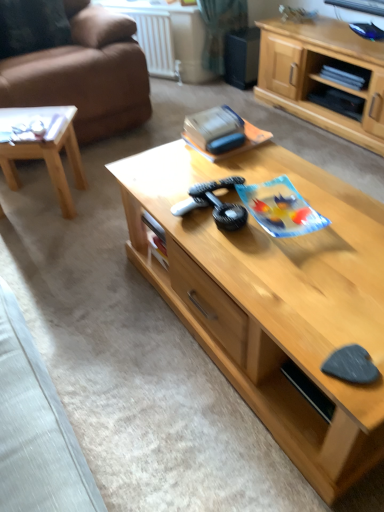
Question: Do you think brown leather couch at left is within light brown wood coffee table at left, marked as the 2th coffee table in a right-to-left arrangement, or outside of it?

Choices:
 (A) inside
 (B) outside

Answer: (B)

Question: Considering the positions of brown leather couch at left and light brown wood coffee table at left, marked as the 2th coffee table in a right-to-left arrangement, in the image, is brown leather couch at left bigger or smaller than light brown wood coffee table at left, marked as the 2th coffee table in a right-to-left arrangement,?

Choices:
 (A) small
 (B) big

Answer: (B)

Question: Which object is the farthest from the light wood cabinet at center?

Choices:
 (A) light brown wood coffee table at left, marked as the 2th coffee table in a right-to-left arrangement
 (B) light wood coffee table at center, which is counted as the second coffee table, starting from the left
 (C) brown leather couch at left
 (D) velvet dark brown pillow at upper left
 (E) white plastic radiator at upper center

Answer: (A)

Question: Estimate the real-world distances between objects in this image. Which object is closer to the light wood cabinet at center?

Choices:
 (A) velvet dark brown pillow at upper left
 (B) white plastic radiator at upper center
 (C) brown leather couch at left
 (D) light brown wood coffee table at left, positioned as the 1th coffee table in left-to-right order
 (E) light wood coffee table at center, which is counted as the second coffee table, starting from the left

Answer: (B)